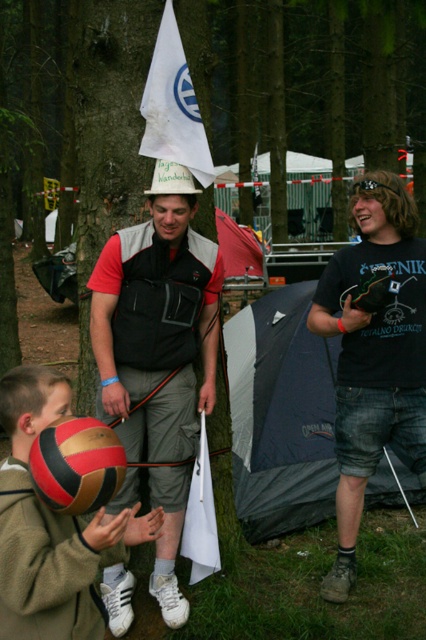
You are a photographer trying to capture both the matte black vest at center and the red and gold textured volleyball at lower left in a single shot. However, you can only focus on one object at a time. Which object should you focus on to ensure the other is visible in the background?

You should focus on the matte black vest at center because the red and gold textured volleyball at lower left is behind it, making it visible in the background.

Looking at this image, you are a park ranger trying to locate the matte black vest at center in a wooded area. According to the coordinates given, where exactly would you find it?

The matte black vest at center is located at point (x=157, y=321).